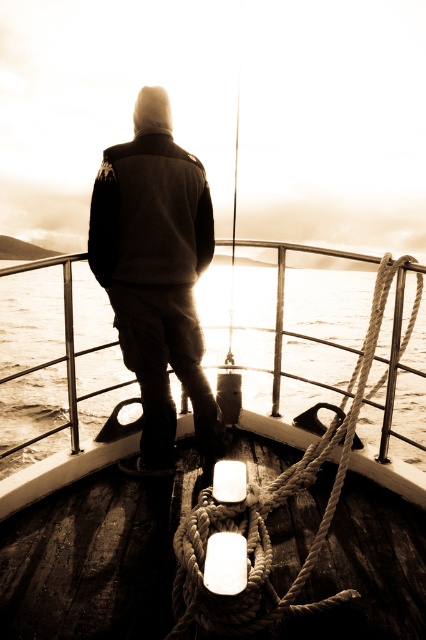
You are a sailor on the boat and need to secure the dark gray hoodie at center and the rope at center. Which item can you more easily thread through a small ring? Explain your reasoning based on their sizes.

The dark gray hoodie at center is thinner than the rope at center, so it can be more easily threaded through a small ring because it has a smaller diameter.

You are a photographer trying to capture the scene of a person on a boat. You notice the dark gray hoodie at center and the rope at center. Which object is closer to you as you take the photo?

The dark gray hoodie at center is closer to you than the rope at center because it is positioned further to the viewer.